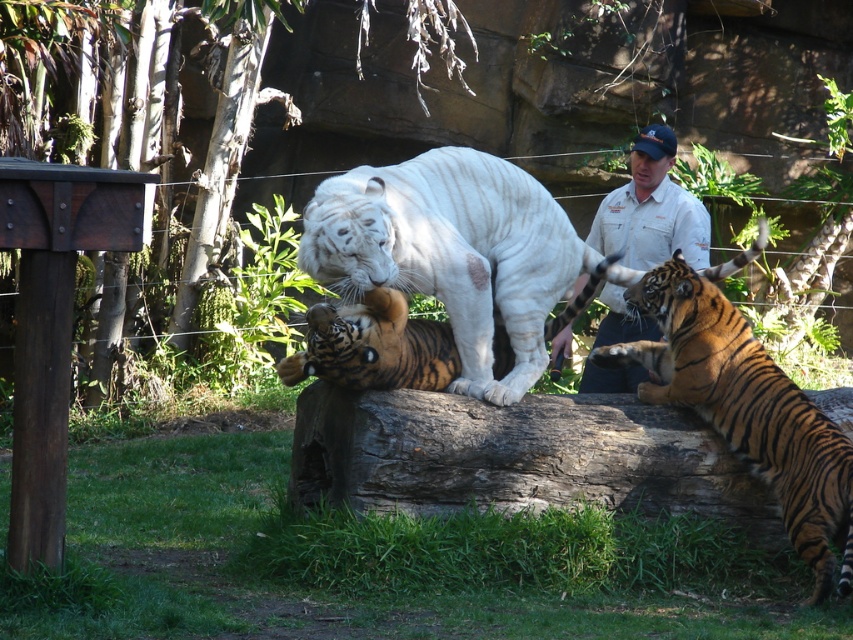
You are a zookeeper who needs to ensure that all tigers have enough space to move comfortably. Given that the white striped tiger at center is wider than the orange striped tiger at center, which tiger requires a larger enclosure to accommodate its size?

The white striped tiger at center requires a larger enclosure because it has a greater width than the orange striped tiger at center.

You are standing at point A which is at coordinates point (x=509, y=284) and want to walk to point B at coordinates point (x=631, y=172). Which direction should you move to get closer to point B?

You should move backward because point (x=509, y=284) is in front of point (x=631, y=172), so moving backward will bring you closer to point B.